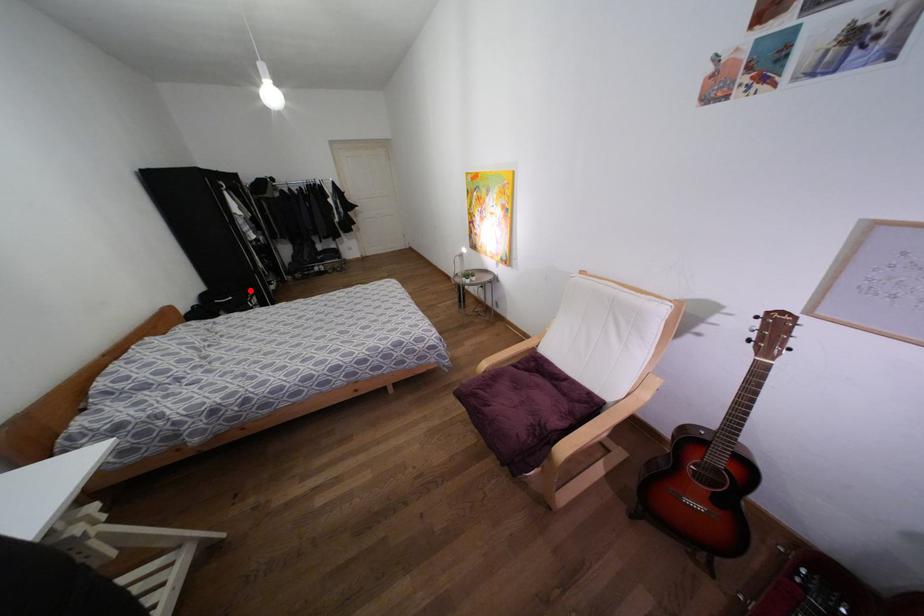
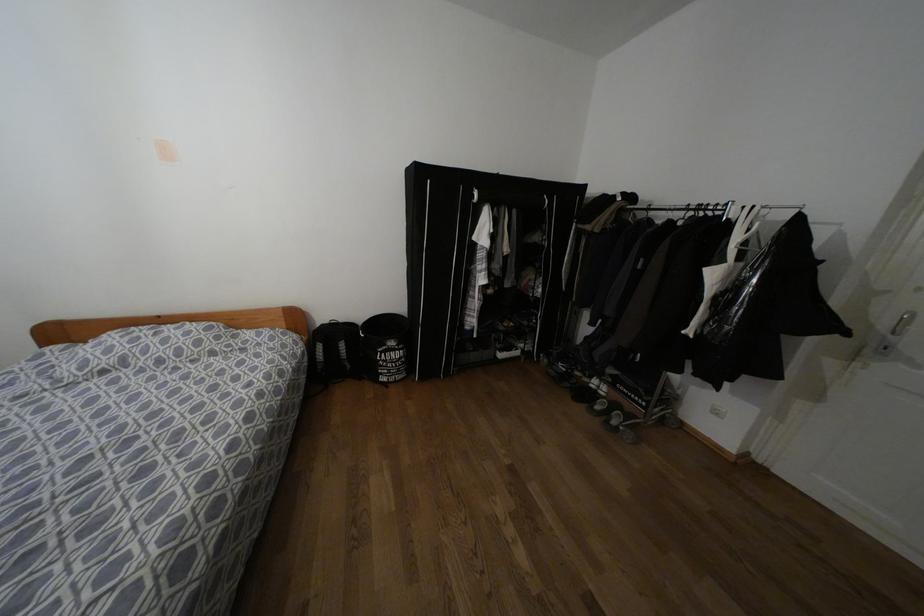
Question: A red point is marked in image1. In image2, is the corresponding 3D point closer to the camera or farther? Reply with the corresponding letter.

Choices:
 (A) The corresponding 3D point is closer.
 (B) The corresponding 3D point is farther.

Answer: (B)